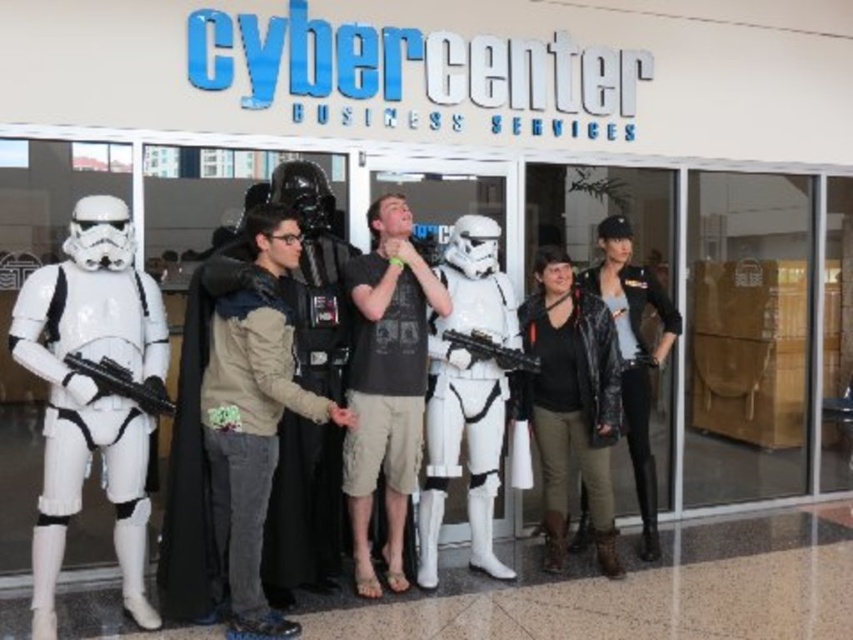
Between point (234, 353) and point (126, 372), which one is positioned in front?

Positioned in front is point (234, 353).

Locate an element on the screen. The width and height of the screenshot is (853, 640). dark matte costume at center is located at coordinates (253, 419).

Between point (270, 353) and point (78, 369), which one is positioned behind?

The point (78, 369) is more distant.

The width and height of the screenshot is (853, 640). In order to click on dark matte costume at center in this screenshot , I will do `click(253, 419)`.

Based on the photo, is dark matte costume at center bigger than black leather jacket at lower right?

Yes.

I want to click on dark matte costume at center, so click(253, 419).

Between point (241, 532) and point (550, 444), which one is positioned in front?

Positioned in front is point (241, 532).

I want to click on dark matte costume at center, so click(x=253, y=419).

Who is more distant from viewer, (56, 314) or (589, 529)?

The point (589, 529) is more distant.

In the scene shown: Who is positioned more to the left, white matte stormtrooper at left or leather jacket at right?

white matte stormtrooper at left

Is point (126, 339) more distant than point (653, 544)?

No, (126, 339) is in front of (653, 544).

You are a GUI agent. You are given a task and a screenshot of the screen. Output one action in this format:
    pyautogui.click(x=<x>, y=<y>)
    Task: Click on the white matte stormtrooper at left
    
    Given the screenshot: What is the action you would take?
    pyautogui.click(x=91, y=394)